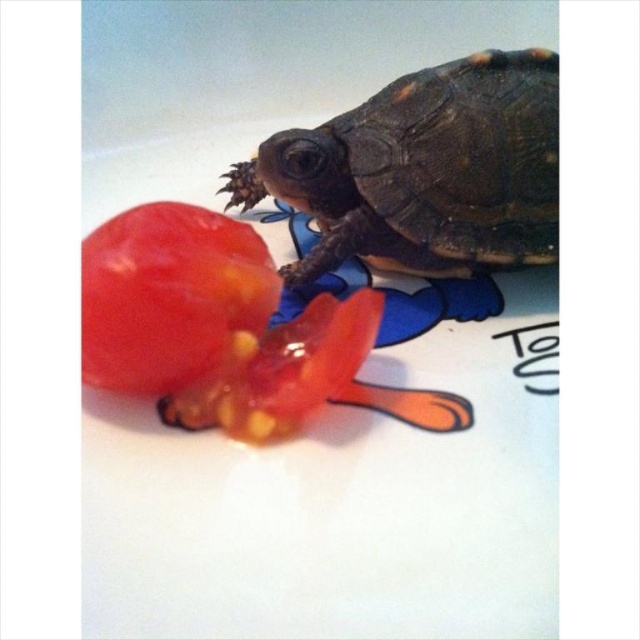
Looking at this image, who is shorter, smooth brown tortoise at upper right or shiny red tomato at center?

Standing shorter between the two is shiny red tomato at center.

Does point (468, 241) lie behind point (166, 324)?

Yes.

Is point (548, 172) more distant than point (221, 253)?

That is True.

The width and height of the screenshot is (640, 640). I want to click on smooth brown tortoise at upper right, so click(426, 170).